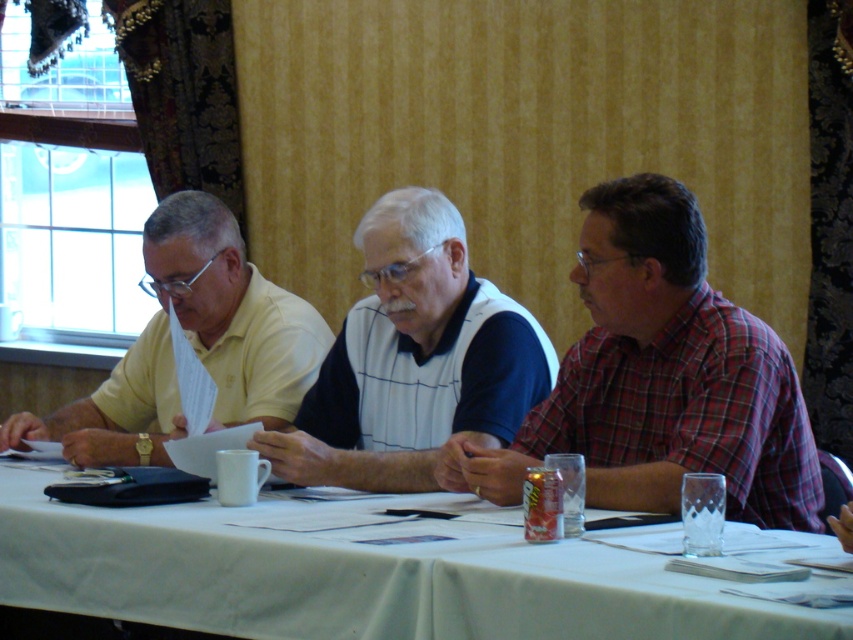
Between white textured polo shirt at center and yellow matte shirt at left, which one is positioned lower?

yellow matte shirt at left is lower down.

Is white textured polo shirt at center taller than yellow matte shirt at left?

Correct, white textured polo shirt at center is much taller as yellow matte shirt at left.

The image size is (853, 640). Identify the location of white textured polo shirt at center. click(x=413, y=358).

Between point (582, 556) and point (611, 186), which one is positioned behind?

The point (611, 186) is behind.

Is white cloth table at center below red plaid shirt at right?

Indeed, white cloth table at center is positioned under red plaid shirt at right.

Does point (405, 589) come farther from viewer compared to point (532, 449)?

No, (405, 589) is in front of (532, 449).

Identify the location of white cloth table at center. Image resolution: width=853 pixels, height=640 pixels. (355, 577).

Which is behind, point (682, 230) or point (476, 378)?

Point (476, 378)

Is red plaid shirt at right shorter than white textured polo shirt at center?

Incorrect, red plaid shirt at right's height does not fall short of white textured polo shirt at center's.

Is point (698, 454) farther from viewer compared to point (450, 278)?

That is False.

Identify the location of red plaid shirt at right. [x=660, y=378].